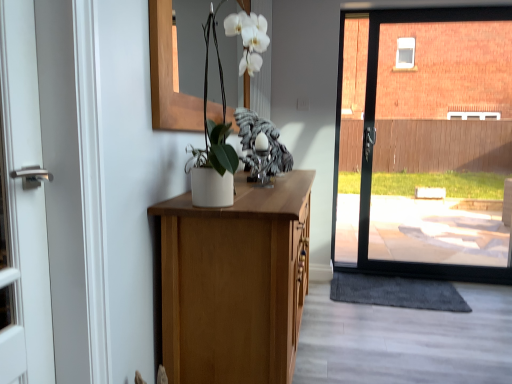
Question: Considering the relative sizes of gray textured doormat at lower right and white matte vase at center in the image provided, is gray textured doormat at lower right smaller than white matte vase at center?

Choices:
 (A) no
 (B) yes

Answer: (B)

Question: Can you confirm if gray textured doormat at lower right is wider than white matte vase at center?

Choices:
 (A) no
 (B) yes

Answer: (B)

Question: Is gray textured doormat at lower right positioned with its back to white matte vase at center?

Choices:
 (A) yes
 (B) no

Answer: (B)

Question: Considering the relative positions of gray textured doormat at lower right and white matte vase at center in the image provided, is gray textured doormat at lower right to the right of white matte vase at center from the viewer's perspective?

Choices:
 (A) yes
 (B) no

Answer: (A)

Question: From the image's perspective, is gray textured doormat at lower right below white matte vase at center?

Choices:
 (A) yes
 (B) no

Answer: (A)

Question: Is gray textured doormat at lower right directly adjacent to white matte vase at center?

Choices:
 (A) no
 (B) yes

Answer: (A)

Question: Does white matte vase at center have a smaller size compared to gray textured doormat at lower right?

Choices:
 (A) no
 (B) yes

Answer: (A)

Question: Does white matte vase at center come in front of gray textured doormat at lower right?

Choices:
 (A) no
 (B) yes

Answer: (B)

Question: From the image's perspective, is white matte vase at center located beneath gray textured doormat at lower right?

Choices:
 (A) no
 (B) yes

Answer: (A)

Question: From a real-world perspective, is white matte vase at center positioned under gray textured doormat at lower right based on gravity?

Choices:
 (A) yes
 (B) no

Answer: (B)

Question: From the image's perspective, is white matte vase at center over gray textured doormat at lower right?

Choices:
 (A) yes
 (B) no

Answer: (A)

Question: Can you see white matte vase at center touching gray textured doormat at lower right?

Choices:
 (A) no
 (B) yes

Answer: (A)

Question: Relative to gray textured doormat at lower right, is white matte vase at center in front or behind?

Choices:
 (A) behind
 (B) front

Answer: (B)